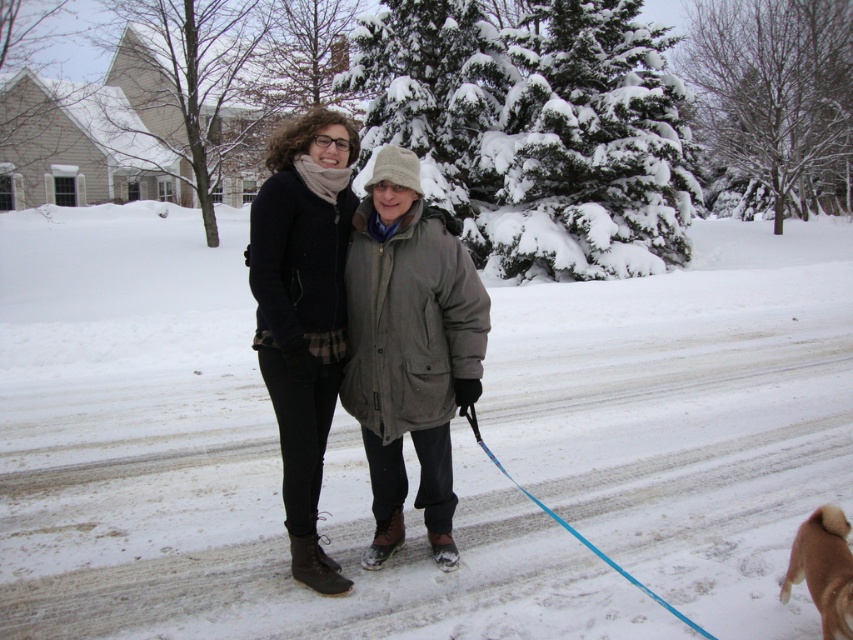
Question: Is dark gray knit sweater at center closer to the viewer compared to brown furry dog at lower right?

Choices:
 (A) yes
 (B) no

Answer: (B)

Question: Does white fluffy snow at center appear over dark gray knit sweater at center?

Choices:
 (A) no
 (B) yes

Answer: (B)

Question: Which object appears farthest from the camera in this image?

Choices:
 (A) matte black coat at center
 (B) white fluffy snow at center
 (C) dark gray knit sweater at center

Answer: (B)

Question: Which of the following is the farthest from the observer?

Choices:
 (A) (180, 522)
 (B) (326, 365)
 (C) (833, 593)

Answer: (A)

Question: Is the position of white fluffy snow at center more distant than that of brown furry dog at lower right?

Choices:
 (A) yes
 (B) no

Answer: (A)

Question: Which object is farther from the camera taking this photo?

Choices:
 (A) dark gray knit sweater at center
 (B) brown furry dog at lower right
 (C) white fluffy snow at center

Answer: (C)